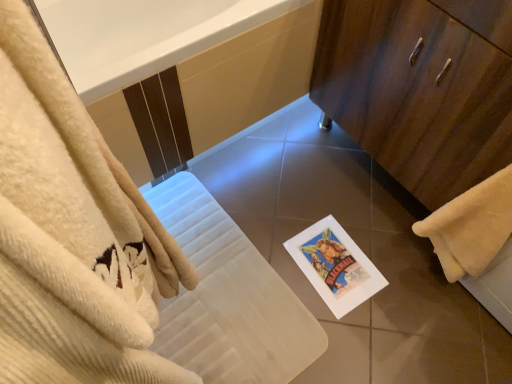
Question: Is there a large distance between yellow fluffy towel at lower right and white glossy bathtub at upper center?

Choices:
 (A) yes
 (B) no

Answer: (B)

Question: Considering the relative positions of yellow fluffy towel at lower right and white glossy bathtub at upper center in the image provided, is yellow fluffy towel at lower right to the left of white glossy bathtub at upper center from the viewer's perspective?

Choices:
 (A) no
 (B) yes

Answer: (A)

Question: Is yellow fluffy towel at lower right closer to the viewer compared to white glossy bathtub at upper center?

Choices:
 (A) yes
 (B) no

Answer: (A)

Question: Is white glossy bathtub at upper center at the back of yellow fluffy towel at lower right?

Choices:
 (A) yes
 (B) no

Answer: (B)

Question: Is yellow fluffy towel at lower right located outside white glossy bathtub at upper center?

Choices:
 (A) yes
 (B) no

Answer: (A)

Question: In the image, is white glossy bathtub at upper center positioned in front of or behind wooden cabinet at right?

Choices:
 (A) front
 (B) behind

Answer: (B)

Question: Is white glossy bathtub at upper center situated inside wooden cabinet at right or outside?

Choices:
 (A) inside
 (B) outside

Answer: (B)

Question: Looking at the image, does white glossy bathtub at upper center seem bigger or smaller compared to wooden cabinet at right?

Choices:
 (A) big
 (B) small

Answer: (A)

Question: From the image's perspective, is white glossy bathtub at upper center positioned above or below wooden cabinet at right?

Choices:
 (A) above
 (B) below

Answer: (A)

Question: Considering the relative positions of wooden cabinet at right and yellow fluffy towel at lower right in the image provided, is wooden cabinet at right to the left or to the right of yellow fluffy towel at lower right?

Choices:
 (A) left
 (B) right

Answer: (A)

Question: From the image's perspective, relative to yellow fluffy towel at lower right, is wooden cabinet at right above or below?

Choices:
 (A) above
 (B) below

Answer: (A)

Question: Is point (498, 13) positioned closer to the camera than point (461, 266)?

Choices:
 (A) closer
 (B) farther

Answer: (A)

Question: From a real-world perspective, is wooden cabinet at right physically located above or below yellow fluffy towel at lower right?

Choices:
 (A) below
 (B) above

Answer: (A)

Question: In the image, is yellow fluffy towel at lower right positioned in front of or behind white glossy bathtub at upper center?

Choices:
 (A) behind
 (B) front

Answer: (B)

Question: Is yellow fluffy towel at lower right to the left or to the right of white glossy bathtub at upper center in the image?

Choices:
 (A) right
 (B) left

Answer: (A)